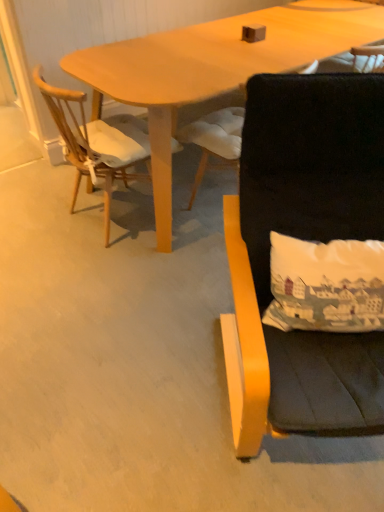
I want to click on free space to the left of black fabric chair at right, which ranks as the 3th chair in left-to-right order, so click(137, 374).